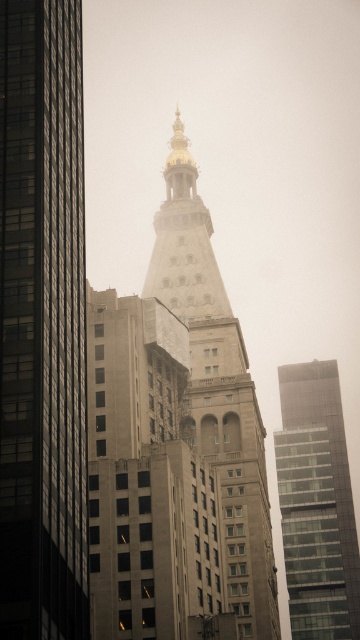
Question: Among these points, which one is nearest to the camera?

Choices:
 (A) 208,346
 (B) 47,118

Answer: (B)

Question: Does golden stone tower at center have a lesser width compared to glassy reflective skyscraper at right?

Choices:
 (A) yes
 (B) no

Answer: (B)

Question: Can you confirm if golden stone tower at center is wider than glassy reflective skyscraper at right?

Choices:
 (A) no
 (B) yes

Answer: (B)

Question: Estimate the real-world distances between objects in this image. Which object is farther from the glassy reflective skyscraper at right?

Choices:
 (A) smooth glass skyscraper at center
 (B) golden stone tower at center

Answer: (A)

Question: From the image, what is the correct spatial relationship of smooth glass skyscraper at center in relation to golden stone tower at center?

Choices:
 (A) left
 (B) right

Answer: (A)

Question: Which point appears closest to the camera in this image?

Choices:
 (A) (10, 579)
 (B) (168, 272)

Answer: (A)